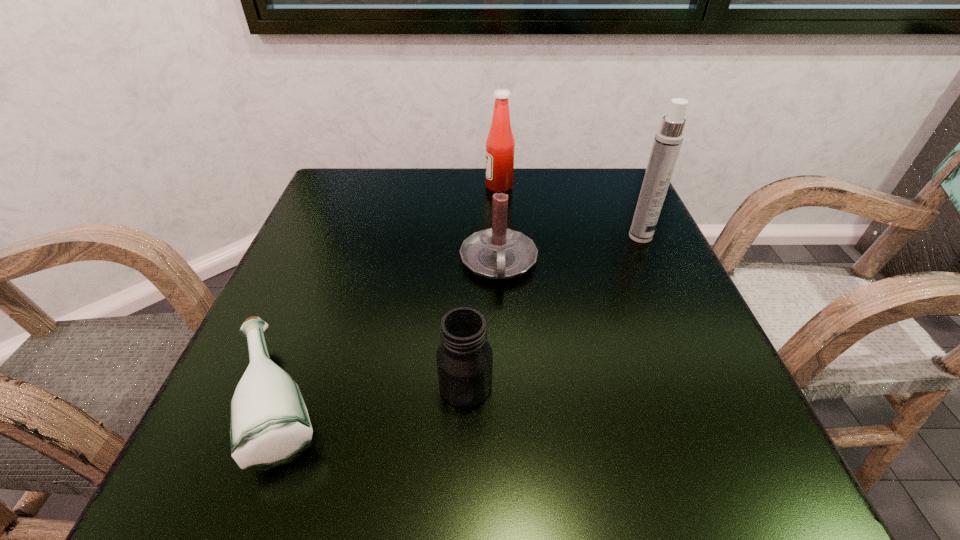
Identify the location of empty space that is in between the aerosol can and the candle. The width and height of the screenshot is (960, 540). (569, 249).

Identify the location of empty space between the farthest object and the leftmost object. (390, 293).

I want to click on vacant space that is in between the jar and the fourth shortest object, so click(x=482, y=286).

Point out which object is positioned as the nearest to the jar. Please provide its 2D coordinates. Your answer should be formatted as a tuple, i.e. [(x, y)], where the tuple contains the x and y coordinates of a point satisfying the conditions above.

[(269, 423)]

Select which object appears as the third closest to the aerosol can. Please provide its 2D coordinates. Your answer should be formatted as a tuple, i.e. [(x, y)], where the tuple contains the x and y coordinates of a point satisfying the conditions above.

[(464, 357)]

You are a GUI agent. You are given a task and a screenshot of the screen. Output one action in this format:
    pyautogui.click(x=<x>, y=<y>)
    Task: Click on the free region that satisfies the following two spatial constraints: 1. on the back side of the leftmost object; 2. on the right side of the aerosol can
    This screenshot has height=540, width=960.
    Given the screenshot: What is the action you would take?
    pyautogui.click(x=344, y=237)

The width and height of the screenshot is (960, 540). I want to click on vacant space that satisfies the following two spatial constraints: 1. on the front-facing side of the aerosol can; 2. on the left side of the farthest object, so click(502, 237).

I want to click on vacant area that satisfies the following two spatial constraints: 1. on the front-facing side of the second tallest object; 2. on the side of the candle with the handle loop, so click(x=504, y=262).

Image resolution: width=960 pixels, height=540 pixels. In order to click on free spot that satisfies the following two spatial constraints: 1. on the front-facing side of the farthest object; 2. on the front side of the jar in this screenshot , I will do `click(512, 386)`.